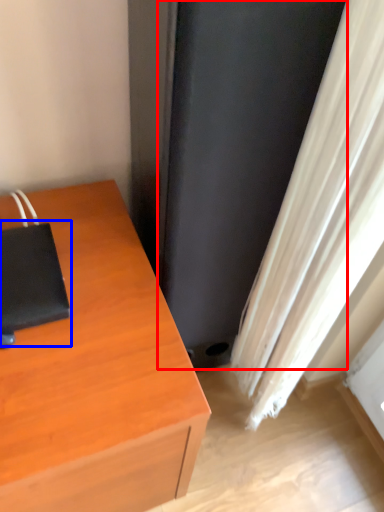
Question: Which object is closer to the camera taking this photo, screen door (highlighted by a red box) or notebook (highlighted by a blue box)?

Choices:
 (A) screen door
 (B) notebook

Answer: (A)